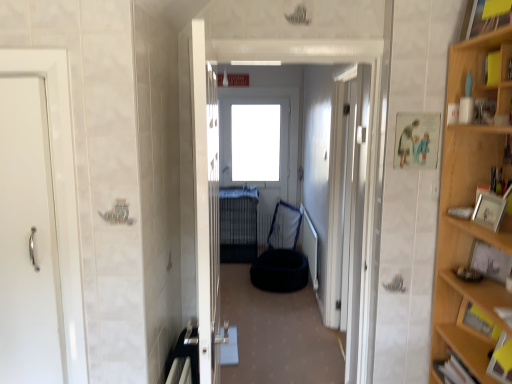
Question: Is dark blue fabric pet bed at center in front of or behind light wood cabinet at right in the image?

Choices:
 (A) behind
 (B) front

Answer: (A)

Question: Is dark blue fabric pet bed at center to the left or to the right of light wood cabinet at right in the image?

Choices:
 (A) left
 (B) right

Answer: (A)

Question: Which of these objects is positioned closest to the wooden picture frame at right, marked as the 2th picture frame in a front-to-back arrangement?

Choices:
 (A) white glossy door at left, which is the 3th door in right-to-left order
 (B) silver metallic picture frame at right, the 1th picture frame from the front
 (C) white glossy door at center, which is the third door from left to right
 (D) yellow paper at upper right
 (E) dark blue fabric pet bed at center

Answer: (B)

Question: Considering the real-world distances, which object is farthest from the white glossy door at center, which ranks as the first door in front-to-back order?

Choices:
 (A) dark blue fabric pet bed at center
 (B) wooden picture frame at right, marked as the 2th picture frame in a front-to-back arrangement
 (C) white glossy door at center, which is the first door in right-to-left order
 (D) white glossy door at left, which is the 3th door in right-to-left order
 (E) wooden bookshelf at right

Answer: (A)